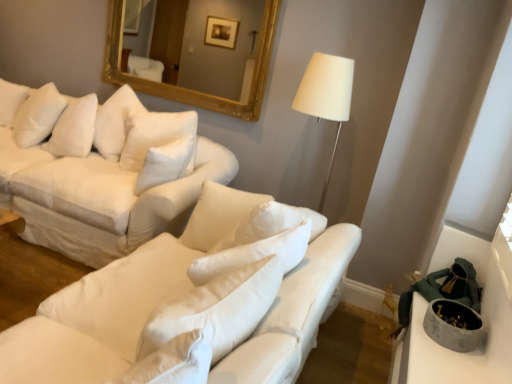
Question: Is concrete bowl at lower right wider than white fabric couch at upper left, which is the second studio couch in front-to-back order?

Choices:
 (A) no
 (B) yes

Answer: (A)

Question: From the image's perspective, is concrete bowl at lower right under white fabric couch at upper left, acting as the 1th studio couch starting from the back?

Choices:
 (A) no
 (B) yes

Answer: (B)

Question: Is concrete bowl at lower right far from white fabric couch at upper left, which is the second studio couch in front-to-back order?

Choices:
 (A) no
 (B) yes

Answer: (B)

Question: Is concrete bowl at lower right directly adjacent to white fabric couch at upper left, which is the second studio couch in front-to-back order?

Choices:
 (A) no
 (B) yes

Answer: (A)

Question: Is concrete bowl at lower right taller than white fabric couch at upper left, acting as the 1th studio couch starting from the back?

Choices:
 (A) no
 (B) yes

Answer: (A)

Question: Could white fabric couch at upper left, which is the second studio couch in front-to-back order, be considered to be inside concrete bowl at lower right?

Choices:
 (A) yes
 (B) no

Answer: (B)

Question: Is white fabric couch at center, marked as the 2th studio couch in a back-to-front arrangement, facing away from concrete bowl at lower right?

Choices:
 (A) yes
 (B) no

Answer: (A)

Question: Is white fabric couch at center, marked as the 2th studio couch in a back-to-front arrangement, completely or partially outside of concrete bowl at lower right?

Choices:
 (A) no
 (B) yes

Answer: (B)

Question: Is white fabric couch at center, which ranks as the first studio couch in front-to-back order, at the left side of concrete bowl at lower right?

Choices:
 (A) no
 (B) yes

Answer: (B)

Question: From a real-world perspective, is white fabric couch at center, marked as the 2th studio couch in a back-to-front arrangement, over concrete bowl at lower right?

Choices:
 (A) yes
 (B) no

Answer: (B)

Question: Does white fabric couch at center, which ranks as the first studio couch in front-to-back order, have a greater width compared to concrete bowl at lower right?

Choices:
 (A) yes
 (B) no

Answer: (A)

Question: Is white fabric couch at center, which ranks as the first studio couch in front-to-back order, to the right of concrete bowl at lower right from the viewer's perspective?

Choices:
 (A) no
 (B) yes

Answer: (A)

Question: Is concrete bowl at lower right positioned before gold-framed mirror at upper center?

Choices:
 (A) yes
 (B) no

Answer: (A)